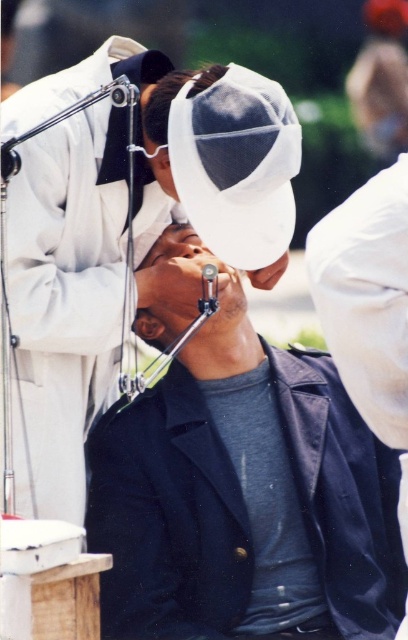
From the picture: Is dark blue fabric jacket at center wider than white mesh cap at upper center?

Yes, dark blue fabric jacket at center is wider than white mesh cap at upper center.

Is point (214, 500) positioned in front of point (206, 84)?

That is False.

Where is `dark blue fabric jacket at center`? The height and width of the screenshot is (640, 408). dark blue fabric jacket at center is located at coordinates (244, 499).

Describe the element at coordinates (68, 291) in the screenshot. I see `matte black jacket at center` at that location.

You are a GUI agent. You are given a task and a screenshot of the screen. Output one action in this format:
    pyautogui.click(x=<x>, y=<y>)
    Task: Click on the matte black jacket at center
    
    Given the screenshot: What is the action you would take?
    pyautogui.click(x=68, y=291)

In order to click on matte black jacket at center in this screenshot , I will do `click(68, 291)`.

Is dark blue fabric jacket at center above matte black jacket at center?

Incorrect, dark blue fabric jacket at center is not positioned above matte black jacket at center.

Can you confirm if dark blue fabric jacket at center is positioned below matte black jacket at center?

Yes, dark blue fabric jacket at center is below matte black jacket at center.

You are a GUI agent. You are given a task and a screenshot of the screen. Output one action in this format:
    pyautogui.click(x=<x>, y=<y>)
    Task: Click on the dark blue fabric jacket at center
    
    Given the screenshot: What is the action you would take?
    pyautogui.click(x=244, y=499)

The height and width of the screenshot is (640, 408). I want to click on dark blue fabric jacket at center, so click(x=244, y=499).